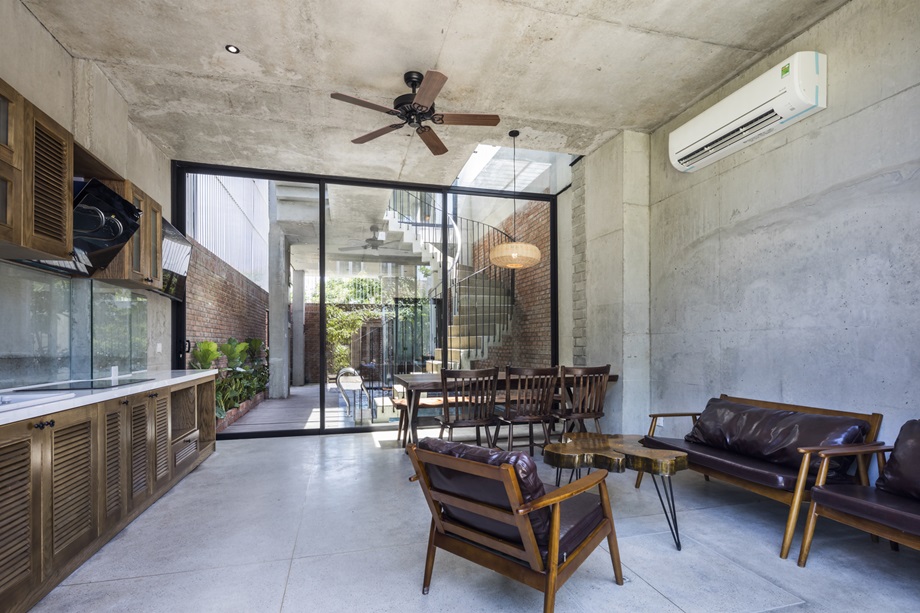
I want to click on floor, so click(257, 520), click(382, 496), click(296, 466), click(366, 581), click(715, 591).